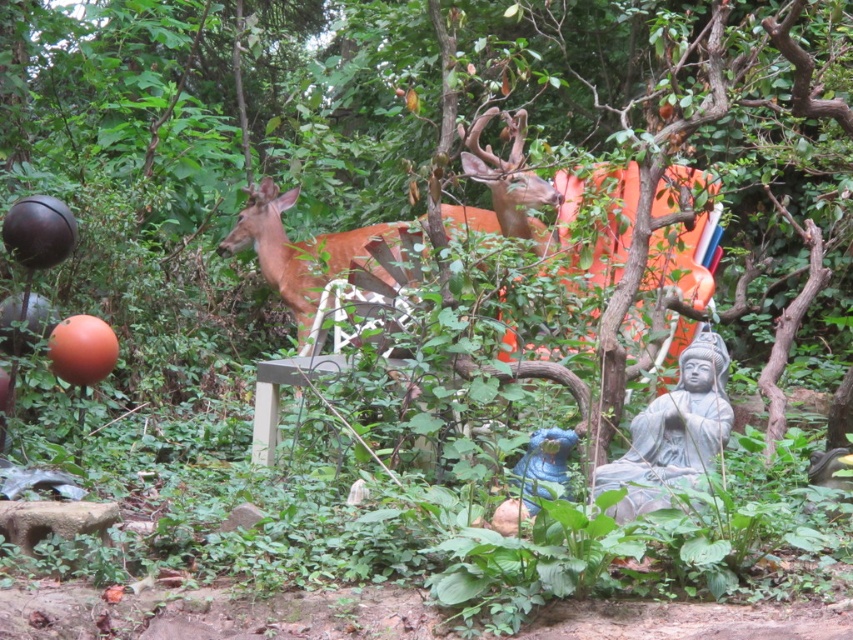
You are a gardener who wants to water the gray stone statue at lower right. You have a hose that can reach 2 meters. The green leafy tree at center is blocking your direct path. Can you reach the statue without moving the tree?

The gray stone statue at lower right is behind the green leafy tree at center, so you can go around the tree to reach it as long as the hose can extend around the tree. Since the hose reaches 2 meters, it should be possible if the distance around the tree is within that range.